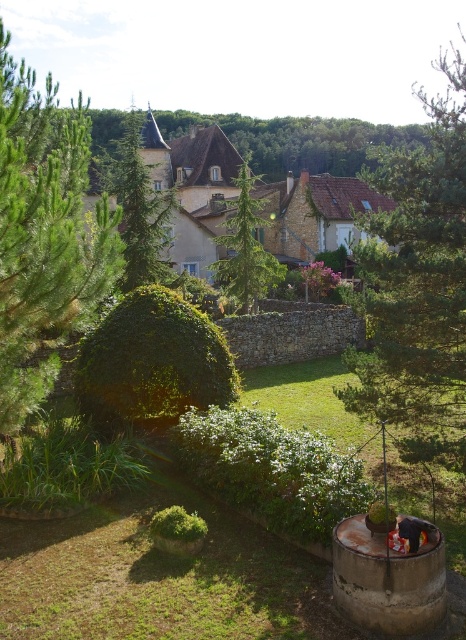
Question: Among these objects, which one is farthest from the camera?

Choices:
 (A) green needle-like tree at left
 (B) green leafy tree at center
 (C) green textured pine tree at upper center
 (D) green leafy tree at upper center

Answer: (D)

Question: Which of these objects is positioned farthest from the green textured tree at center?

Choices:
 (A) dark blue jeans at lower right
 (B) green needle-like tree at left

Answer: (A)

Question: Is green needle-like tree at left smaller than green textured tree at center?

Choices:
 (A) no
 (B) yes

Answer: (B)

Question: Among these objects, which one is nearest to the camera?

Choices:
 (A) dark blue jeans at lower right
 (B) green leafy tree at center
 (C) green needle-like tree at left

Answer: (C)

Question: Does green textured pine tree at upper center come behind green textured tree at center?

Choices:
 (A) yes
 (B) no

Answer: (B)

Question: Is green leafy tree at center behind dark blue jeans at lower right?

Choices:
 (A) no
 (B) yes

Answer: (B)